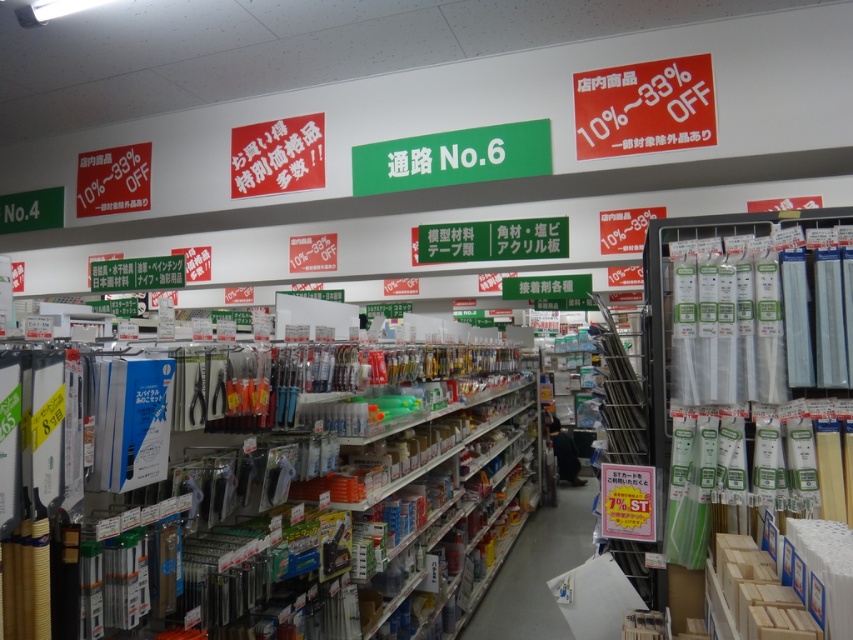
Locate an element on the screen. clear plastic tubes at right is located at coordinates (752, 396).

Is point (819, 412) behind point (648, 128)?

That is False.

Does point (804, 417) come in front of point (621, 67)?

That is True.

Locate an element on the screen. This screenshot has width=853, height=640. clear plastic tubes at right is located at coordinates (752, 396).